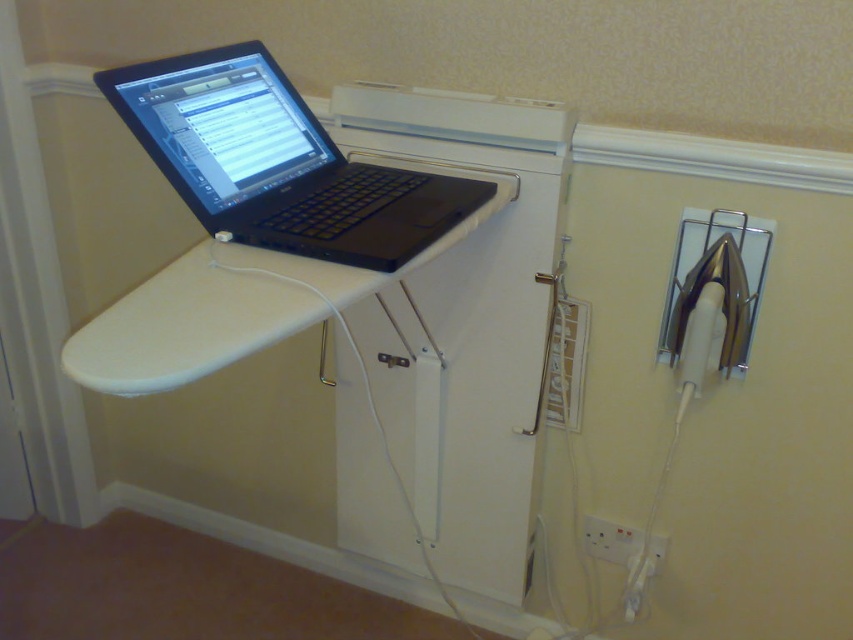
Does black matte laptop at upper left have a smaller size compared to white plastic electric outlet at lower center?

Actually, black matte laptop at upper left might be larger than white plastic electric outlet at lower center.

Does point (343, 205) come behind point (610, 547)?

No, (343, 205) is in front of (610, 547).

Does point (408, 208) come farther from viewer compared to point (624, 556)?

No, (408, 208) is in front of (624, 556).

Locate an element on the screen. black matte laptop at upper left is located at coordinates (277, 163).